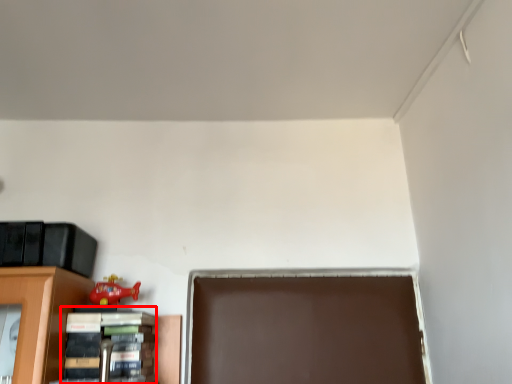
Question: In this image, where is book (annotated by the red box) located relative to toy?

Choices:
 (A) left
 (B) right

Answer: (B)